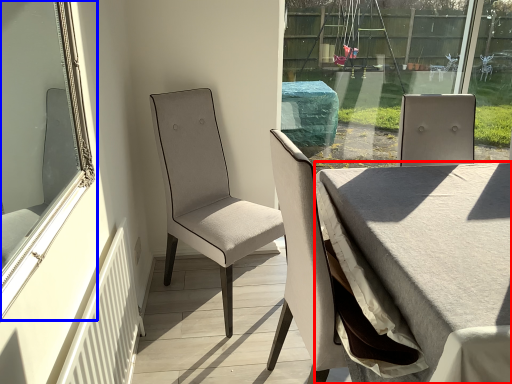
Question: Among these objects, which one is farthest to the camera, table (highlighted by a red box) or window (highlighted by a blue box)?

Choices:
 (A) table
 (B) window

Answer: (A)